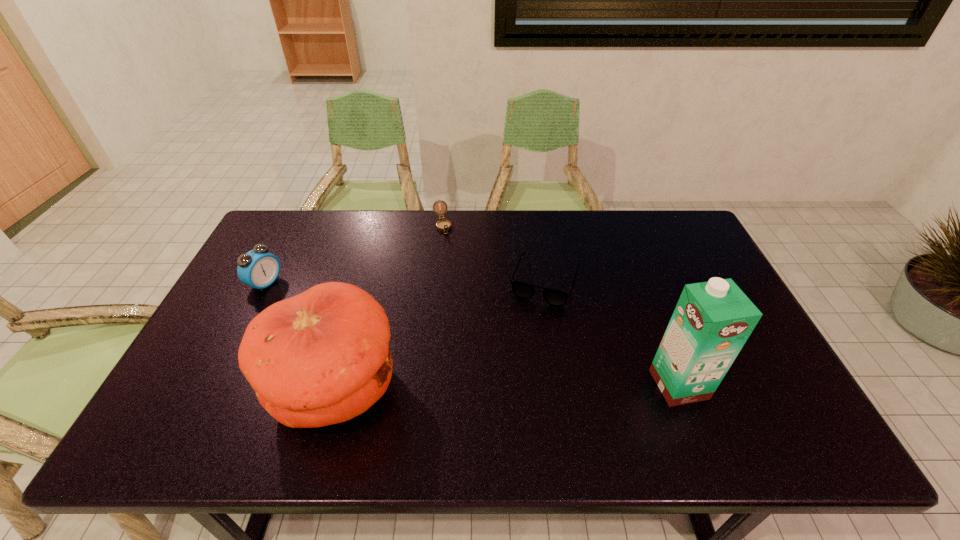
The width and height of the screenshot is (960, 540). Identify the location of pumpkin. (322, 357).

This screenshot has width=960, height=540. Find the location of `carton`. carton is located at coordinates (712, 320).

What are the coordinates of `the farthest object` in the screenshot? It's located at (444, 225).

This screenshot has width=960, height=540. Find the location of `compass`. compass is located at coordinates (444, 225).

Where is `the second object from right to left`? the second object from right to left is located at coordinates 522,290.

At what (x,y) coordinates should I click in order to perform the action: click on the leftmost object. Please return your answer as a coordinate pair (x, y). Image resolution: width=960 pixels, height=540 pixels. Looking at the image, I should click on (258, 268).

Locate an element on the screen. alarm clock is located at coordinates (258, 268).

The height and width of the screenshot is (540, 960). In order to click on free space located on the right of the second object from left to right in this screenshot , I will do coord(452,389).

Where is `free space located on the left of the rightmost object`? The image size is (960, 540). free space located on the left of the rightmost object is located at coordinates (592, 384).

What are the coordinates of `free point located on the face of the compass` in the screenshot? It's located at (450, 258).